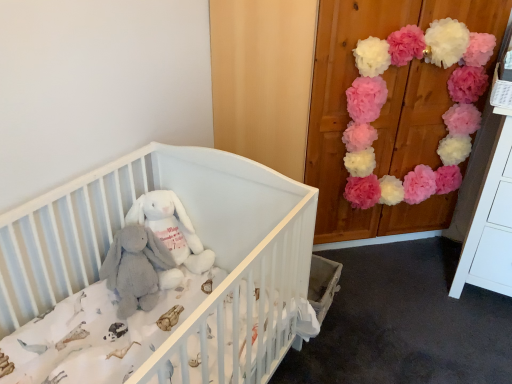
Image resolution: width=512 pixels, height=384 pixels. I want to click on white plush rabbit at center, so click(x=170, y=228).

Find the location of a particular element. gray plush elephant at center is located at coordinates (135, 268).

Locate an element on the screen. white soft crib at center is located at coordinates point(200,239).

From the image's perspective, which one is positioned lower, gray plush elephant at center or white soft crib at center?

white soft crib at center appears lower in the image.

From the picture: Which of these two, gray plush elephant at center or white soft crib at center, is thinner?

gray plush elephant at center is thinner.

Is gray plush elephant at center to the left of white soft crib at center from the viewer's perspective?

Correct, you'll find gray plush elephant at center to the left of white soft crib at center.

From a real-world perspective, is pink tissue paper pom-poms at upper right below gray plush elephant at center?

Actually, pink tissue paper pom-poms at upper right is physically above gray plush elephant at center in the real world.

Considering the positions of points (457, 155) and (136, 228), is point (457, 155) closer to camera compared to point (136, 228)?

No.

Is pink tissue paper pom-poms at upper right shorter than gray plush elephant at center?

Incorrect, the height of pink tissue paper pom-poms at upper right does not fall short of that of gray plush elephant at center.

Does pink tissue paper pom-poms at upper right appear on the left side of gray plush elephant at center?

No.

The height and width of the screenshot is (384, 512). In the image, there is a white plush rabbit at center. Find the location of `infant bed below it (from the image's perspective)`. infant bed below it (from the image's perspective) is located at coordinates (200, 239).

In terms of height, does white plush rabbit at center look taller or shorter compared to white soft crib at center?

Clearly, white plush rabbit at center is shorter compared to white soft crib at center.

Is white plush rabbit at center smaller than white soft crib at center?

Indeed, white plush rabbit at center has a smaller size compared to white soft crib at center.

From the image's perspective, is white plush rabbit at center located beneath white soft crib at center?

Actually, white plush rabbit at center appears above white soft crib at center in the image.

In terms of width, does white plush rabbit at center look wider or thinner when compared to gray plush elephant at center?

Clearly, white plush rabbit at center has more width compared to gray plush elephant at center.

How far apart are white plush rabbit at center and gray plush elephant at center?

A distance of 3.87 inches exists between white plush rabbit at center and gray plush elephant at center.

From the image's perspective, is white plush rabbit at center above or below gray plush elephant at center?

Based on their image positions, white plush rabbit at center is located above gray plush elephant at center.

Can you confirm if white plush rabbit at center is smaller than gray plush elephant at center?

Yes.

Can you confirm if white soft crib at center is wider than white plush rabbit at center?

Indeed, white soft crib at center has a greater width compared to white plush rabbit at center.

In the scene shown: From a real-world perspective, is white soft crib at center physically located above or below white plush rabbit at center?

In terms of real-world spatial position, white soft crib at center is below white plush rabbit at center.

How much distance is there between white soft crib at center and white plush rabbit at center?

white soft crib at center is 10.71 inches from white plush rabbit at center.

Is white soft crib at center positioned with its back to white plush rabbit at center?

Yes.

You are a GUI agent. You are given a task and a screenshot of the screen. Output one action in this format:
    pyautogui.click(x=<x>, y=<y>)
    Task: Click on the flower to the right of white plush rabbit at center
    The width and height of the screenshot is (512, 384).
    Given the screenshot: What is the action you would take?
    pyautogui.click(x=443, y=116)

Can you confirm if white plush rabbit at center is positioned to the right of pink tissue paper pom-poms at upper right?

No.

Does white plush rabbit at center have a larger size compared to pink tissue paper pom-poms at upper right?

Actually, white plush rabbit at center might be smaller than pink tissue paper pom-poms at upper right.

Which of these two, white plush rabbit at center or pink tissue paper pom-poms at upper right, stands shorter?

With less height is white plush rabbit at center.

Consider the image. Is gray plush elephant at center positioned with its back to pink tissue paper pom-poms at upper right?

No.

From a real-world perspective, which is physically below, gray plush elephant at center or pink tissue paper pom-poms at upper right?

From a 3D spatial view, gray plush elephant at center is below.

How many degrees apart are the facing directions of gray plush elephant at center and pink tissue paper pom-poms at upper right?

The angle between the facing direction of gray plush elephant at center and the facing direction of pink tissue paper pom-poms at upper right is 49.2 degrees.

This screenshot has width=512, height=384. What are the coordinates of `flower on the right of gray plush elephant at center` in the screenshot? It's located at (443, 116).

Find the location of a particular element. infant bed lying in front of the gray plush elephant at center is located at coordinates (200, 239).

At what (x,y) coordinates should I click in order to perform the action: click on flower above the gray plush elephant at center (from a real-world perspective). Please return your answer as a coordinate pair (x, y). This screenshot has width=512, height=384. Looking at the image, I should click on (443, 116).

In the scene shown: From the image, which object appears to be farther from white soft crib at center, white plush rabbit at center or pink tissue paper pom-poms at upper right?

pink tissue paper pom-poms at upper right is further to white soft crib at center.

Estimate the real-world distances between objects in this image. Which object is closer to pink tissue paper pom-poms at upper right, white plush rabbit at center or gray plush elephant at center?

white plush rabbit at center lies closer to pink tissue paper pom-poms at upper right than the other object.

When comparing their distances from white plush rabbit at center, does white soft crib at center or pink tissue paper pom-poms at upper right seem further?

pink tissue paper pom-poms at upper right lies further to white plush rabbit at center than the other object.

From the image, which object appears to be nearer to white plush rabbit at center, gray plush elephant at center or pink tissue paper pom-poms at upper right?

The object closer to white plush rabbit at center is gray plush elephant at center.

Based on the photo, when comparing their distances from white soft crib at center, does gray plush elephant at center or white plush rabbit at center seem further?

gray plush elephant at center is positioned further to the anchor white soft crib at center.

From the image, which object appears to be nearer to white plush rabbit at center, white soft crib at center or gray plush elephant at center?

gray plush elephant at center lies closer to white plush rabbit at center than the other object.

Considering their positions, is pink tissue paper pom-poms at upper right positioned further to gray plush elephant at center than white soft crib at center?

pink tissue paper pom-poms at upper right is further to gray plush elephant at center.

Estimate the real-world distances between objects in this image. Which object is further from gray plush elephant at center, white plush rabbit at center or pink tissue paper pom-poms at upper right?

pink tissue paper pom-poms at upper right lies further to gray plush elephant at center than the other object.

Where is `baby elephant located between white soft crib at center and white plush rabbit at center in the depth direction`? The height and width of the screenshot is (384, 512). baby elephant located between white soft crib at center and white plush rabbit at center in the depth direction is located at coordinates (135, 268).

Where is `toy located between gray plush elephant at center and pink tissue paper pom-poms at upper right in the left-right direction`? toy located between gray plush elephant at center and pink tissue paper pom-poms at upper right in the left-right direction is located at coordinates (170, 228).

I want to click on toy situated between white soft crib at center and pink tissue paper pom-poms at upper right from left to right, so click(170, 228).

You are a GUI agent. You are given a task and a screenshot of the screen. Output one action in this format:
    pyautogui.click(x=<x>, y=<y>)
    Task: Click on the infant bed between gray plush elephant at center and pink tissue paper pom-poms at upper right from left to right
    The width and height of the screenshot is (512, 384).
    Given the screenshot: What is the action you would take?
    pyautogui.click(x=200, y=239)